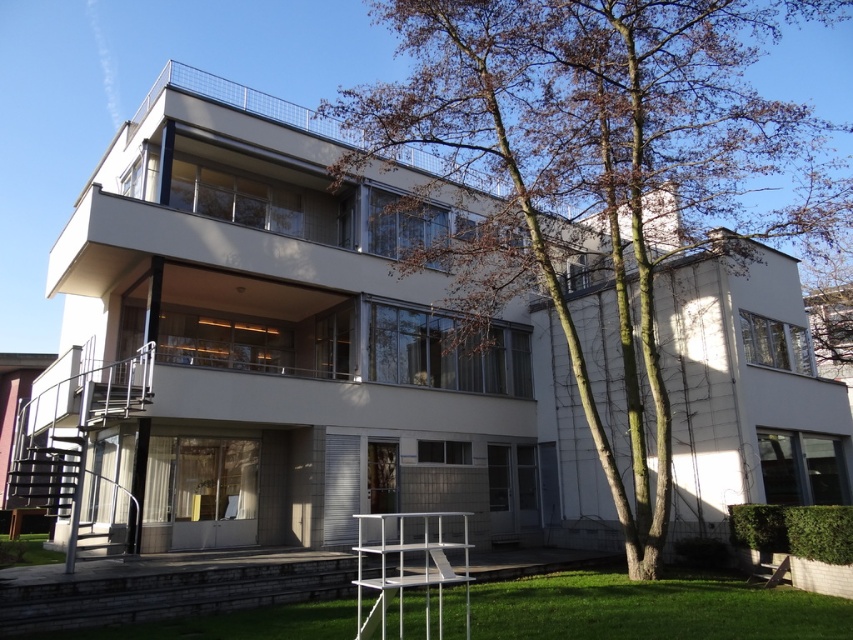
Looking at this image, you are standing on the green grass at lower left and want to reach the entrance of the modernist building. The path leads directly to the building, but there is a brown leafy tree at center in your way. Can you walk around the tree to get to the entrance?

The brown leafy tree at center is above green grass at lower left, so you can walk around the tree since it is elevated and does not block the path on the ground.

You are standing in front of the modernist building and want to plant a new flower bed between the brown leafy tree at center and the green grass at lower center. Considering their sizes, which area would be more suitable for the flower bed?

The green grass at lower center is smaller than the brown leafy tree at center, so the flower bed would be more suitable in the area of the green grass at lower center since it requires less space.

You are standing in front of the modernist building and want to walk from the green grass at lower left to the green grass at lower center. Which direction should you move in?

You should move to the right to reach the green grass at lower center from the green grass at lower left since it is positioned to the right of it.